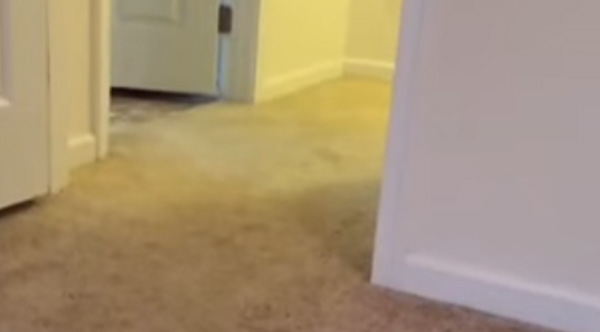
This screenshot has width=600, height=332. Find the location of `molding`. molding is located at coordinates (456, 292).